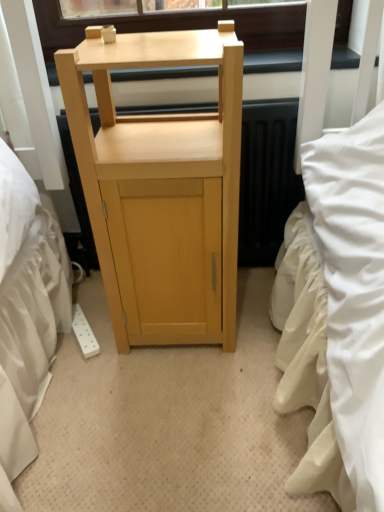
Question: Considering the positions of point (56, 11) and point (175, 163), is point (56, 11) closer or farther from the camera than point (175, 163)?

Choices:
 (A) farther
 (B) closer

Answer: (A)

Question: From the image's perspective, is matte wood table at upper center above or below light wood cabinet at center?

Choices:
 (A) below
 (B) above

Answer: (B)

Question: Looking at the image, does matte wood table at upper center seem bigger or smaller compared to light wood cabinet at center?

Choices:
 (A) small
 (B) big

Answer: (A)

Question: Visually, is light wood cabinet at center positioned to the left or to the right of matte wood table at upper center?

Choices:
 (A) left
 (B) right

Answer: (A)

Question: In the image, is light wood cabinet at center positioned in front of or behind matte wood table at upper center?

Choices:
 (A) behind
 (B) front

Answer: (B)

Question: Does point (109, 73) appear closer or farther from the camera than point (235, 14)?

Choices:
 (A) closer
 (B) farther

Answer: (A)

Question: Looking at the image, does light wood cabinet at center seem bigger or smaller compared to matte wood table at upper center?

Choices:
 (A) big
 (B) small

Answer: (A)